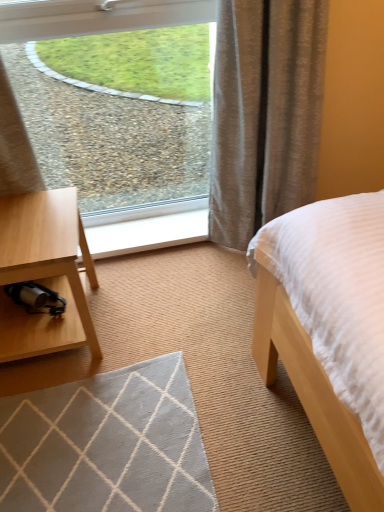
Question: Is clear glass window at upper left bigger or smaller than white wood at center?

Choices:
 (A) small
 (B) big

Answer: (B)

Question: Relative to white wood at center, is clear glass window at upper left in front or behind?

Choices:
 (A) behind
 (B) front

Answer: (B)

Question: Which object is positioned closest to the textured beige curtain at upper right?

Choices:
 (A) clear glass window at upper left
 (B) white wood at center

Answer: (A)

Question: Which object is the closest to the textured beige curtain at upper right?

Choices:
 (A) clear glass window at upper left
 (B) white wood at center

Answer: (A)